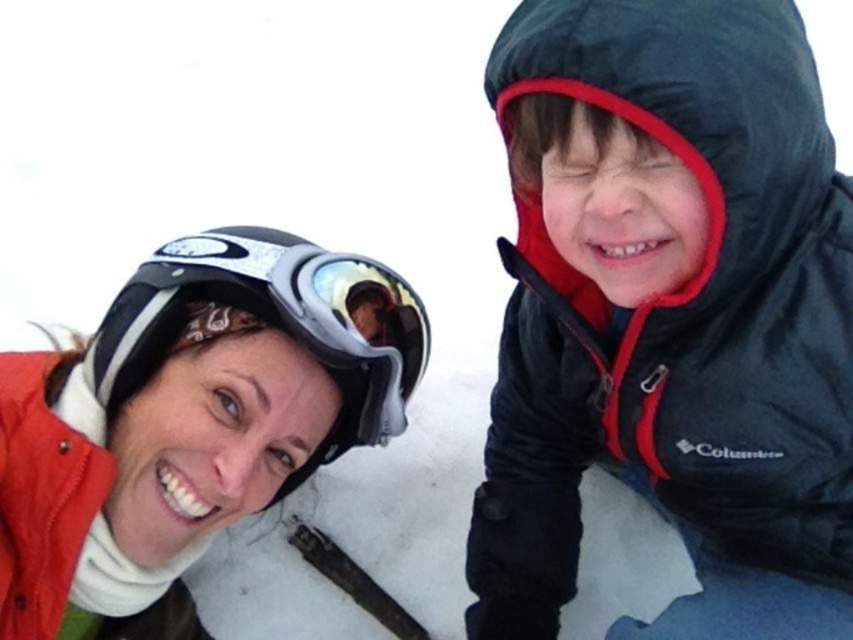
You are standing at the point marked as point (x=606, y=404) in the snowy scene. If you want to walk towards the viewer, which direction should you move?

Since the point (x=606, y=404) and the viewer are 5.63 feet apart, you should move towards the viewer by heading in the direction opposite to where the point is located relative to the viewer.

You are designing a storage space for winter gear. You have two items to store, the matte black jacket at upper right and the matte black helmet at upper left. Which item requires more storage space?

The matte black jacket at upper right requires more storage space because it is bigger than the matte black helmet at upper left.